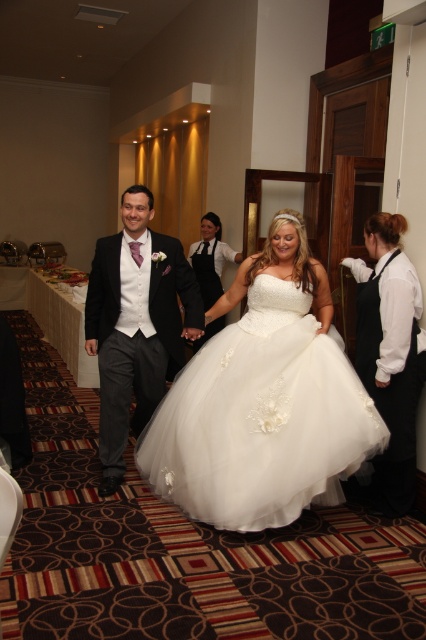
Question: Can you confirm if white tulle dress at center is thinner than white satin dress at center?

Choices:
 (A) no
 (B) yes

Answer: (A)

Question: Can you confirm if white tulle dress at center is positioned above white satin dress at right?

Choices:
 (A) no
 (B) yes

Answer: (A)

Question: Which object appears closest to the camera in this image?

Choices:
 (A) white satin dress at center
 (B) white satin dress at right

Answer: (B)

Question: Is the position of white tulle dress at center more distant than that of matte black suit at center?

Choices:
 (A) yes
 (B) no

Answer: (B)

Question: Which point is closer to the camera taking this photo?

Choices:
 (A) (112, 456)
 (B) (408, 378)
 (C) (268, 284)
 (D) (206, 237)

Answer: (C)

Question: Which point is farther to the camera?

Choices:
 (A) matte black suit at center
 (B) white satin dress at center
 (C) white satin dress at right

Answer: (B)